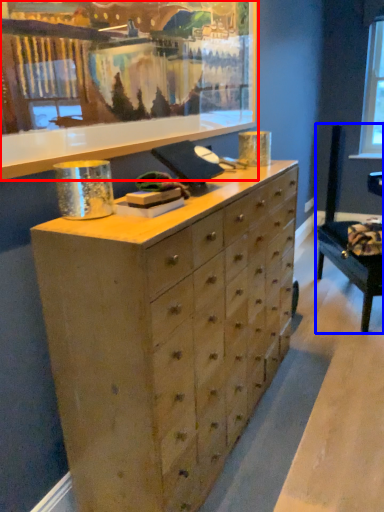
Question: Which object appears closest to the camera in this image, picture frame (highlighted by a red box) or swivel chair (highlighted by a blue box)?

Choices:
 (A) picture frame
 (B) swivel chair

Answer: (A)